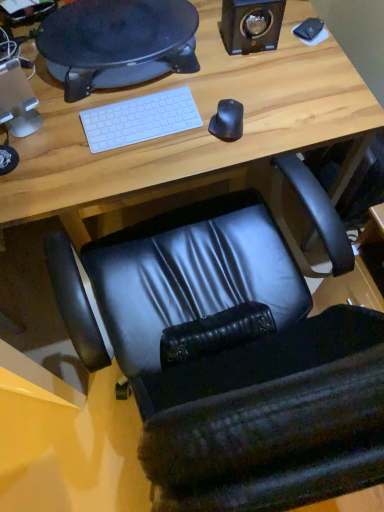
Question: Does point click(382, 467) appear closer or farther from the camera than point click(97, 110)?

Choices:
 (A) closer
 (B) farther

Answer: (A)

Question: From the image's perspective, relative to white matte keyboard at center, is black leather chair at center above or below?

Choices:
 (A) above
 (B) below

Answer: (B)

Question: Based on their relative distances, which object is farther from the black rubber mouse at center?

Choices:
 (A) matte black chair at lower center
 (B) black leather chair at center
 (C) black matte speaker at upper right
 (D) white matte keyboard at center
 (E) matte black desk at upper center

Answer: (B)

Question: Which object is positioned closest to the matte black desk at upper center?

Choices:
 (A) matte black chair at lower center
 (B) black leather chair at center
 (C) white matte keyboard at center
 (D) black matte speaker at upper right
 (E) black rubber mouse at center

Answer: (A)